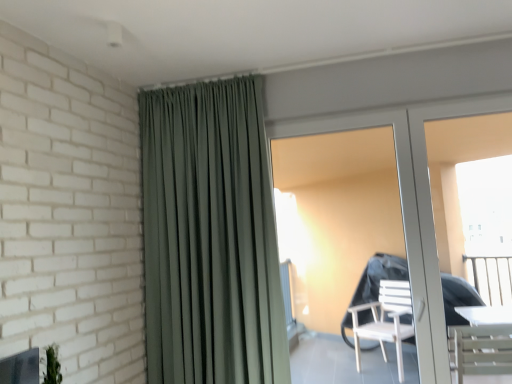
Question: From a real-world perspective, does satin green curtain at upper center stand above white glossy screen door at right?

Choices:
 (A) no
 (B) yes

Answer: (B)

Question: Is satin green curtain at upper center shorter than white glossy screen door at right?

Choices:
 (A) yes
 (B) no

Answer: (B)

Question: Is satin green curtain at upper center located outside white glossy screen door at right?

Choices:
 (A) no
 (B) yes

Answer: (B)

Question: Is satin green curtain at upper center facing away from white glossy screen door at right?

Choices:
 (A) yes
 (B) no

Answer: (B)

Question: Is satin green curtain at upper center far from white glossy screen door at right?

Choices:
 (A) yes
 (B) no

Answer: (A)

Question: Can you confirm if satin green curtain at upper center is wider than white glossy screen door at right?

Choices:
 (A) no
 (B) yes

Answer: (B)

Question: From the image's perspective, is white glossy door at center on top of white glossy screen door at right?

Choices:
 (A) no
 (B) yes

Answer: (A)

Question: Is white glossy screen door at right at the back of white glossy door at center?

Choices:
 (A) no
 (B) yes

Answer: (B)

Question: Can white glossy screen door at right be found inside white glossy door at center?

Choices:
 (A) yes
 (B) no

Answer: (A)

Question: Can you confirm if white glossy door at center is thinner than white glossy screen door at right?

Choices:
 (A) yes
 (B) no

Answer: (B)

Question: Considering the relative sizes of white glossy door at center and white glossy screen door at right in the image provided, is white glossy door at center smaller than white glossy screen door at right?

Choices:
 (A) no
 (B) yes

Answer: (A)

Question: Is white glossy door at center placed right next to white glossy screen door at right?

Choices:
 (A) no
 (B) yes

Answer: (B)

Question: Does white glossy door at center appear on the left side of satin green curtain at upper center?

Choices:
 (A) yes
 (B) no

Answer: (B)